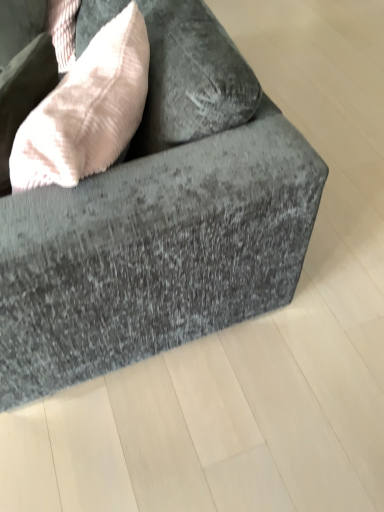
Identify the location of velvet gray couch at center. The height and width of the screenshot is (512, 384). (159, 223).

What do you see at coordinates (159, 223) in the screenshot?
I see `velvet gray couch at center` at bounding box center [159, 223].

The width and height of the screenshot is (384, 512). What do you see at coordinates (87, 110) in the screenshot?
I see `light pink textured throw pillow at upper left` at bounding box center [87, 110].

What is the approximate width of light pink textured throw pillow at upper left?

The width of light pink textured throw pillow at upper left is 9.27 inches.

The image size is (384, 512). I want to click on light pink textured throw pillow at upper left, so click(87, 110).

Identify the location of velvet gray couch at center. click(x=159, y=223).

Which is more to the left, light pink textured throw pillow at upper left or velvet gray couch at center?

From the viewer's perspective, light pink textured throw pillow at upper left appears more on the left side.

Relative to velvet gray couch at center, is light pink textured throw pillow at upper left in front or behind?

light pink textured throw pillow at upper left is behind velvet gray couch at center.

Which point is more distant from viewer, (122,81) or (24,248)?

The point (122,81) is farther from the camera.

From the image's perspective, is light pink textured throw pillow at upper left located above velvet gray couch at center?

Actually, light pink textured throw pillow at upper left appears below velvet gray couch at center in the image.

From a real-world perspective, is light pink textured throw pillow at upper left physically above velvet gray couch at center?

Correct, in the physical world, light pink textured throw pillow at upper left is higher than velvet gray couch at center.

Looking at this image, can you confirm if light pink textured throw pillow at upper left is thinner than velvet gray couch at center?

Yes, light pink textured throw pillow at upper left is thinner than velvet gray couch at center.

Considering the relative sizes of light pink textured throw pillow at upper left and velvet gray couch at center in the image provided, is light pink textured throw pillow at upper left taller than velvet gray couch at center?

No.

Considering the sizes of light pink textured throw pillow at upper left and velvet gray couch at center in the image, is light pink textured throw pillow at upper left bigger or smaller than velvet gray couch at center?

Considering their sizes, light pink textured throw pillow at upper left takes up less space than velvet gray couch at center.

Is light pink textured throw pillow at upper left outside of velvet gray couch at center?

Actually, light pink textured throw pillow at upper left is within velvet gray couch at center.

Would you say light pink textured throw pillow at upper left is a long distance from velvet gray couch at center?

No, there isn't a large distance between light pink textured throw pillow at upper left and velvet gray couch at center.

Is light pink textured throw pillow at upper left facing towards velvet gray couch at center?

Yes, light pink textured throw pillow at upper left is turned towards velvet gray couch at center.

How many degrees apart are the facing directions of light pink textured throw pillow at upper left and velvet gray couch at center?

The angular difference between light pink textured throw pillow at upper left and velvet gray couch at center is 38.9 degrees.

From the picture: Measure the distance from light pink textured throw pillow at upper left to velvet gray couch at center.

9.35 inches.

Find the location of a particular element. throw pillow that is below the velvet gray couch at center (from the image's perspective) is located at coordinates (87, 110).

Considering the relative positions of velvet gray couch at center and light pink textured throw pillow at upper left in the image provided, is velvet gray couch at center to the left of light pink textured throw pillow at upper left from the viewer's perspective?

Incorrect, velvet gray couch at center is not on the left side of light pink textured throw pillow at upper left.

Which object is closer to the camera, velvet gray couch at center or light pink textured throw pillow at upper left?

velvet gray couch at center.

Is point (31, 345) less distant than point (73, 81)?

That is False.

Consider the image. From the image's perspective, between velvet gray couch at center and light pink textured throw pillow at upper left, who is located below?

light pink textured throw pillow at upper left.

From a real-world perspective, is velvet gray couch at center physically located above or below light pink textured throw pillow at upper left?

velvet gray couch at center is situated lower than light pink textured throw pillow at upper left in the real world.

Is velvet gray couch at center wider or thinner than light pink textured throw pillow at upper left?

In the image, velvet gray couch at center appears to be wider than light pink textured throw pillow at upper left.

Does velvet gray couch at center have a greater height compared to light pink textured throw pillow at upper left?

Indeed, velvet gray couch at center has a greater height compared to light pink textured throw pillow at upper left.

Which of these two, velvet gray couch at center or light pink textured throw pillow at upper left, is smaller?

light pink textured throw pillow at upper left is smaller.

Is velvet gray couch at center situated inside light pink textured throw pillow at upper left or outside?

velvet gray couch at center is not enclosed by light pink textured throw pillow at upper left.

Can you see velvet gray couch at center touching light pink textured throw pillow at upper left?

velvet gray couch at center and light pink textured throw pillow at upper left are clearly separated.

Could you tell me if velvet gray couch at center is turned towards light pink textured throw pillow at upper left?

Yes, velvet gray couch at center is aimed at light pink textured throw pillow at upper left.

What's the angular difference between velvet gray couch at center and light pink textured throw pillow at upper left's facing directions?

They differ by 38.9 degrees in their facing directions.

Find the location of `throw pillow above the velvet gray couch at center (from a real-world perspective)`. throw pillow above the velvet gray couch at center (from a real-world perspective) is located at coordinates (87, 110).

You are a GUI agent. You are given a task and a screenshot of the screen. Output one action in this format:
    pyautogui.click(x=<x>, y=<y>)
    Task: Click on the studio couch beneath the light pink textured throw pillow at upper left (from a real-world perspective)
    Image resolution: width=384 pixels, height=512 pixels.
    Given the screenshot: What is the action you would take?
    pyautogui.click(x=159, y=223)

You are a GUI agent. You are given a task and a screenshot of the screen. Output one action in this format:
    pyautogui.click(x=<x>, y=<y>)
    Task: Click on the throw pillow behind the velvet gray couch at center
    
    Given the screenshot: What is the action you would take?
    pyautogui.click(x=87, y=110)